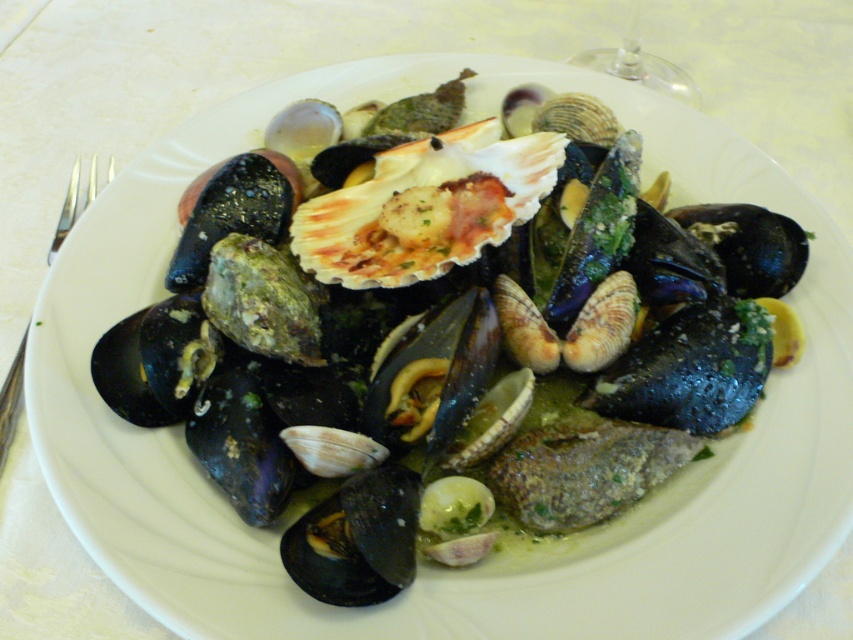
Is transparent glass at upper right shorter than silver metallic fork at left?

Yes, transparent glass at upper right is shorter than silver metallic fork at left.

Who is more distant from viewer, [630,72] or [96,163]?

The point [630,72] is more distant.

Locate an element on the screen. The width and height of the screenshot is (853, 640). transparent glass at upper right is located at coordinates (640, 65).